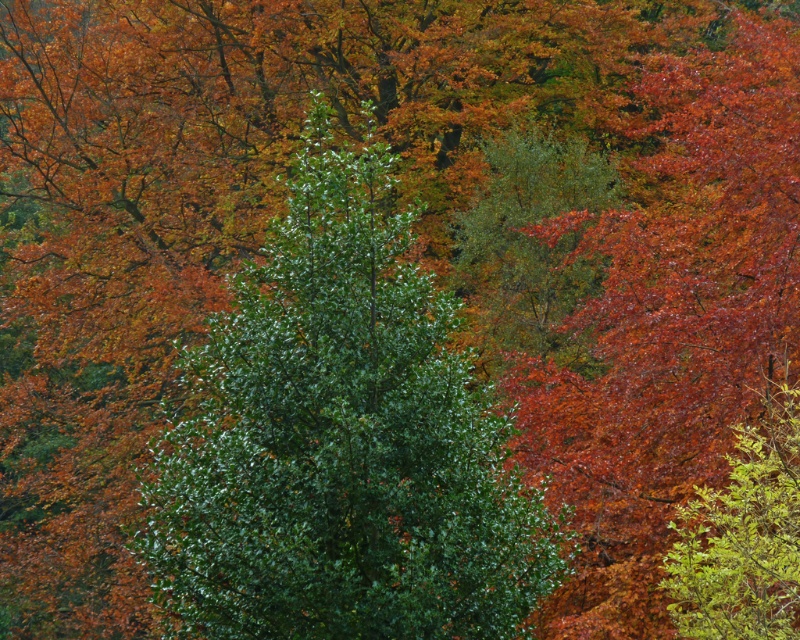
You are a hiker who wants to take a photo of the green glossy tree at center and the green leafy shrub at right. Which one should you stand closer to in order to capture both in a single frame without zooming?

The green glossy tree at center is shorter than the green leafy shrub at right. To capture both in a single frame without zooming, you should stand closer to the green glossy tree at center so that the shrub at right doesn